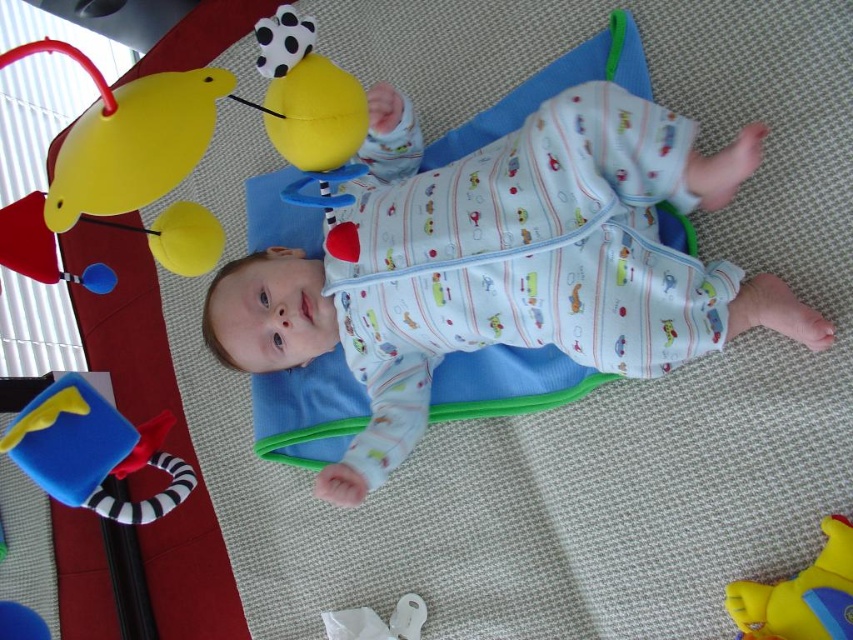
You are a parent trying to reach for the yellow rubber duck at upper left while looking at the baby in the white cotton onesie at center. Which object is closer to you?

The yellow rubber duck at upper left is closer to you because the white cotton onesie at center is located above it, meaning the duck is positioned lower and nearer in the scene.

You are a parent looking at the baby in the image. You notice the white cotton onesie at center and the matte yellow duck at upper left. Which object is positioned more to the left?

The matte yellow duck at upper left is more to the left than the white cotton onesie at center.

You are a photographer taking a picture of the baby on the play mat. You notice two points marked in the scene at coordinates point (x=387, y=154) and point (x=108, y=140). Which point is closer to your camera lens?

Point (x=387, y=154) is further to the camera than point (x=108, y=140), so the point closer to the camera lens is point (x=108, y=140).